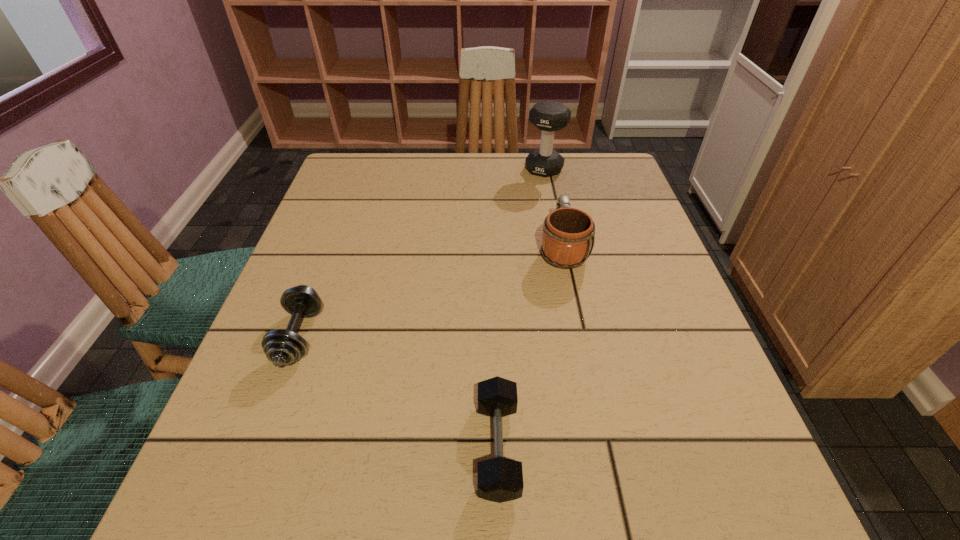
You are a GUI agent. You are given a task and a screenshot of the screen. Output one action in this format:
    pyautogui.click(x=<x>, y=<y>)
    Task: Click on the vacant point located between the farthest object and the second farthest object
    This screenshot has height=540, width=960.
    Given the screenshot: What is the action you would take?
    pyautogui.click(x=553, y=208)

Locate an element on the screen. vacant region between the mug and the leftmost object is located at coordinates (431, 292).

Identify the location of vacant area that lies between the leftmost object and the farthest object. (421, 253).

Identify which object is the third nearest to the nearest object. Please provide its 2D coordinates. Your answer should be formatted as a tuple, i.e. [(x, y)], where the tuple contains the x and y coordinates of a point satisfying the conditions above.

[(549, 116)]

Identify the location of the closest object to the mug. The height and width of the screenshot is (540, 960). (549, 116).

Identify which dumbbell is the nearest to the nearest object. Please provide its 2D coordinates. Your answer should be formatted as a tuple, i.e. [(x, y)], where the tuple contains the x and y coordinates of a point satisfying the conditions above.

[(282, 347)]

Locate an element on the screen. The image size is (960, 540). dumbbell that is the closest one to the nearest object is located at coordinates (282, 347).

Image resolution: width=960 pixels, height=540 pixels. Identify the location of free spot that satisfies the following two spatial constraints: 1. on the back side of the nearest dumbbell; 2. on the right side of the farthest object. (490, 169).

You are a GUI agent. You are given a task and a screenshot of the screen. Output one action in this format:
    pyautogui.click(x=<x>, y=<y>)
    Task: Click on the vacant area in the image that satisfies the following two spatial constraints: 1. on the back side of the rightmost dumbbell; 2. on the right side of the second nearest object
    The height and width of the screenshot is (540, 960).
    Given the screenshot: What is the action you would take?
    pyautogui.click(x=361, y=169)